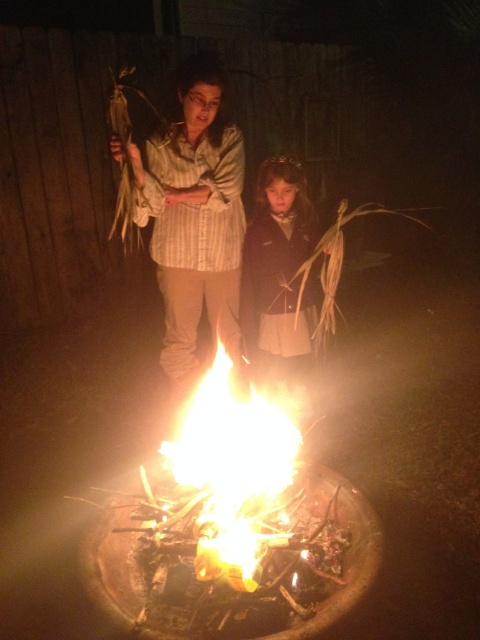
You are taking a photo of the nighttime scene with a camera positioned at the same level as the fire pit. There are two points marked in the image at coordinates point [178,269] and point [288,280]. Which point will appear closer to the bottom edge of your photo?

Point [288,280] will appear closer to the bottom edge of the photo because it is closer to the camera than point [178,269], which is further away.